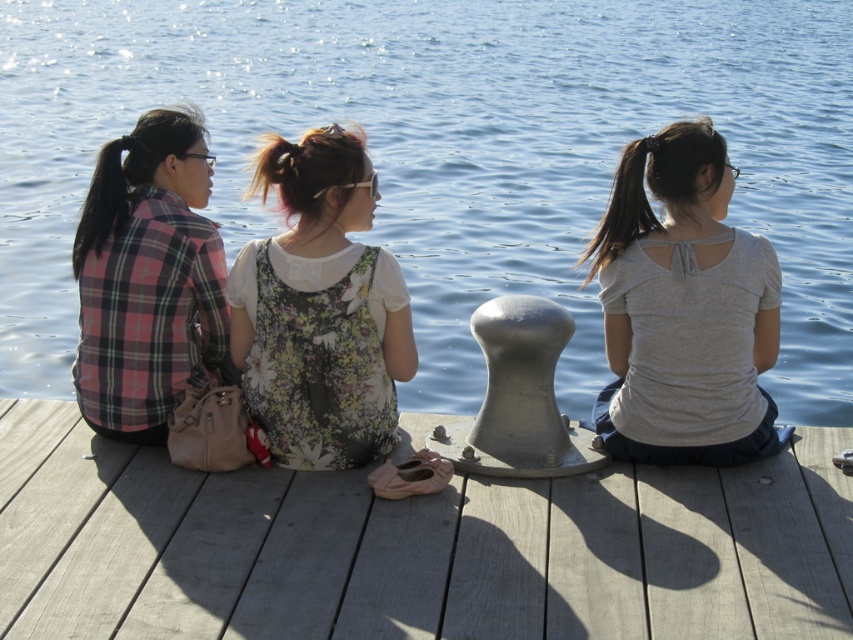
You are standing at the edge of the smooth wooden dock at center. If you walk straight ahead, will you step into water or onto land?

The smooth wooden dock at center is located at point (413, 547), which is over water, so stepping straight ahead would lead into water.

You are standing at the edge of a wooden dock facing three women sitting on the dock. You want to throw a small object to the point marked as point (178, 48). Is this point within your throwing range if your maximum throwing distance is 70 feet?

The point (178, 48) is 74.68 feet from the viewer, which exceeds your maximum throwing range of 70 feet. You cannot reach it with your throw.

You are standing on the wooden dock where the three women are sitting. You want to take a photo of the blue water at center. Where should you point your camera?

You should point your camera towards the blue water at center located at point (445, 154).